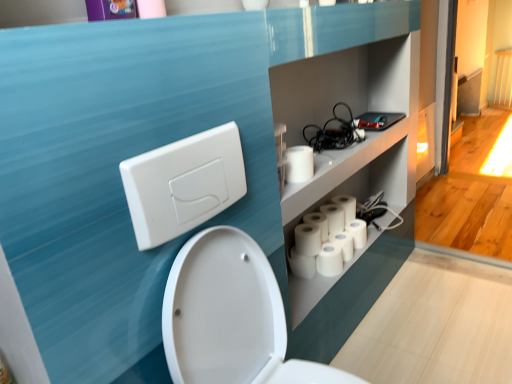
Question: Does white matte toilet paper at center, positioned as the third toilet paper in back-to-front order, appear on the right side of white glossy toilet at center?

Choices:
 (A) no
 (B) yes

Answer: (B)

Question: Is white matte toilet paper at center, positioned as the third toilet paper in back-to-front order, shorter than white glossy toilet at center?

Choices:
 (A) yes
 (B) no

Answer: (A)

Question: From the image's perspective, would you say white matte toilet paper at center, positioned as the third toilet paper in back-to-front order, is shown under white glossy toilet at center?

Choices:
 (A) yes
 (B) no

Answer: (B)

Question: Is the surface of white matte toilet paper at center, acting as the 4th toilet paper starting from the front, in direct contact with white glossy toilet at center?

Choices:
 (A) no
 (B) yes

Answer: (A)

Question: From the image's perspective, is white matte toilet paper at center, acting as the 4th toilet paper starting from the front, on top of white glossy toilet at center?

Choices:
 (A) yes
 (B) no

Answer: (A)

Question: Considering the relative sizes of white matte toilet paper at center, positioned as the third toilet paper in back-to-front order, and white glossy toilet at center in the image provided, is white matte toilet paper at center, positioned as the third toilet paper in back-to-front order, wider than white glossy toilet at center?

Choices:
 (A) no
 (B) yes

Answer: (A)

Question: Is white matte toilet paper at upper right, the sixth toilet paper positioned from the back, shorter than white matte toilet paper at center, acting as the 4th toilet paper starting from the front?

Choices:
 (A) no
 (B) yes

Answer: (B)

Question: Could you tell me if white matte toilet paper at upper right, marked as the first toilet paper in a front-to-back arrangement, is turned towards white matte toilet paper at center, acting as the 4th toilet paper starting from the front?

Choices:
 (A) no
 (B) yes

Answer: (A)

Question: Is white matte toilet paper at center, acting as the 4th toilet paper starting from the front, at the back of white matte toilet paper at upper right, the sixth toilet paper positioned from the back?

Choices:
 (A) no
 (B) yes

Answer: (A)

Question: Is white matte toilet paper at upper right, marked as the first toilet paper in a front-to-back arrangement, closer to camera compared to white matte toilet paper at center, acting as the 4th toilet paper starting from the front?

Choices:
 (A) yes
 (B) no

Answer: (A)

Question: Can you confirm if white matte toilet paper at upper right, marked as the first toilet paper in a front-to-back arrangement, is positioned to the left of white matte toilet paper at center, positioned as the third toilet paper in back-to-front order?

Choices:
 (A) no
 (B) yes

Answer: (B)

Question: Can you confirm if white matte toilet paper at upper right, marked as the first toilet paper in a front-to-back arrangement, is taller than white matte toilet paper at center, positioned as the third toilet paper in back-to-front order?

Choices:
 (A) no
 (B) yes

Answer: (A)

Question: Is purple glossy picture frame at upper left further to the viewer compared to white matte toilet paper at lower center, which appears as the 2th toilet paper when viewed from the front?

Choices:
 (A) yes
 (B) no

Answer: (B)